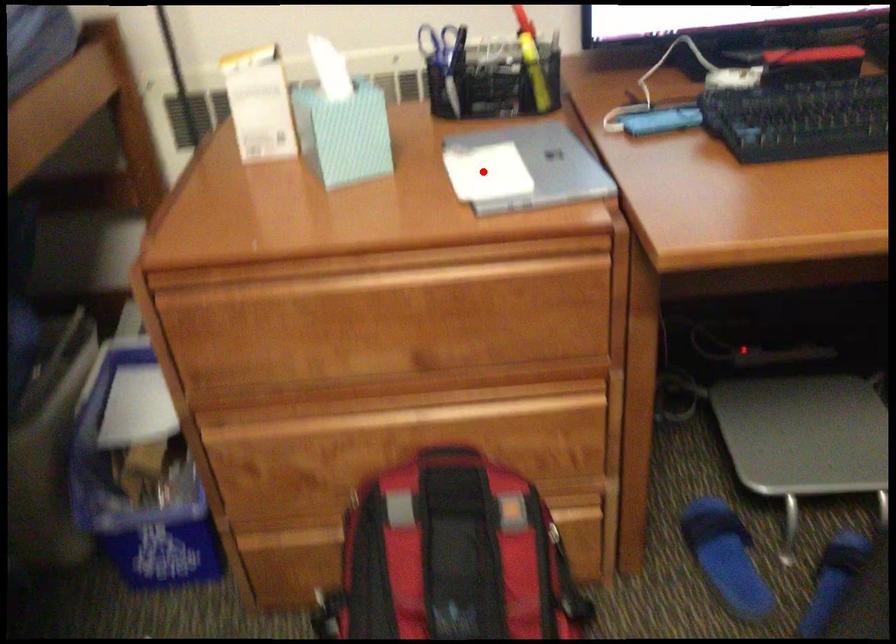
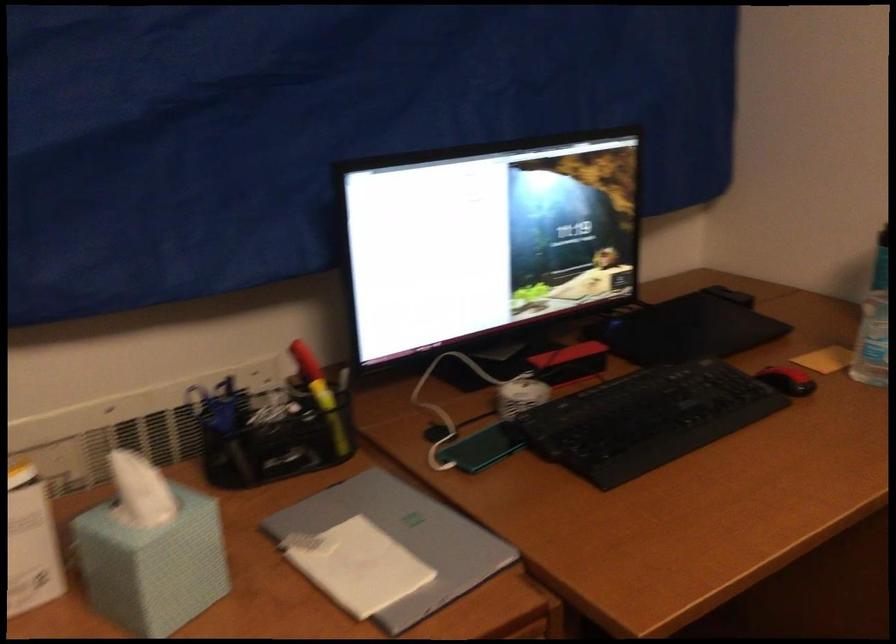
Question: I am providing you with two images of the same scene from different viewpoints. A red point is marked on the first image. Can you still see the location of the red point in image 2?

Choices:
 (A) Yes
 (B) No

Answer: (A)